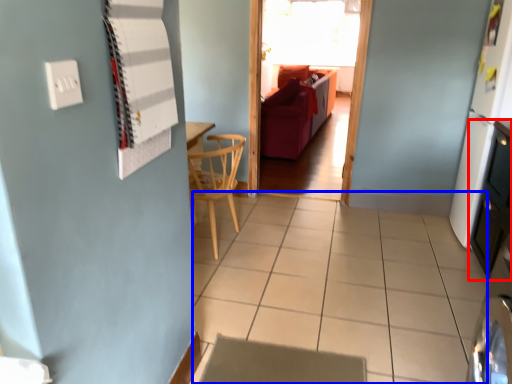
Question: Which object appears farthest to the camera in this image, dresser (highlighted by a red box) or tile (highlighted by a blue box)?

Choices:
 (A) dresser
 (B) tile

Answer: (A)